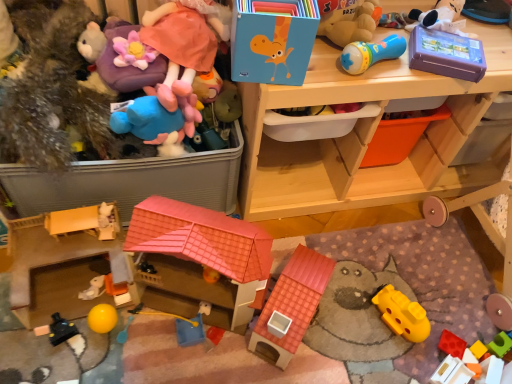
Find the location of `vacant area that lies between rubberized plastic blocks at lower right, positioned as the first toy in right-to-left order, and yellow rubber ball at lower left, the fourth toy from the left`. vacant area that lies between rubberized plastic blocks at lower right, positioned as the first toy in right-to-left order, and yellow rubber ball at lower left, the fourth toy from the left is located at coordinates (301, 344).